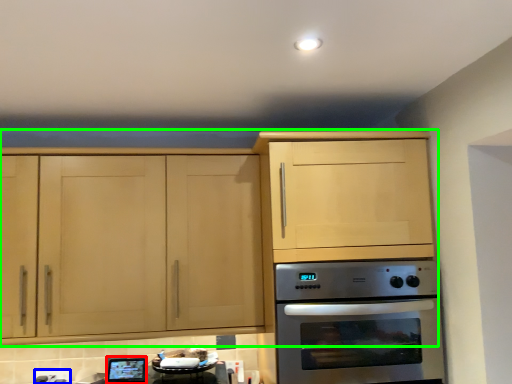
Question: Based on their relative distances, which object is farther from appliance (highlighted by a red box)? Choose from electric outlet (highlighted by a blue box) and cabinetry (highlighted by a green box).

Choices:
 (A) electric outlet
 (B) cabinetry

Answer: (B)